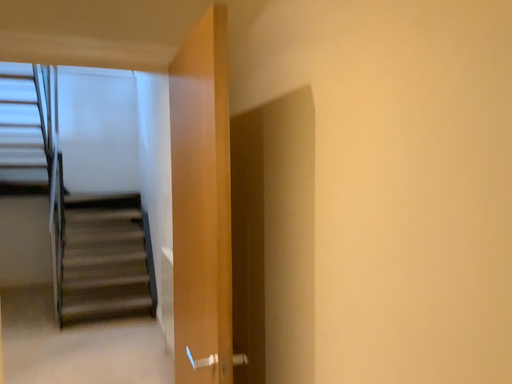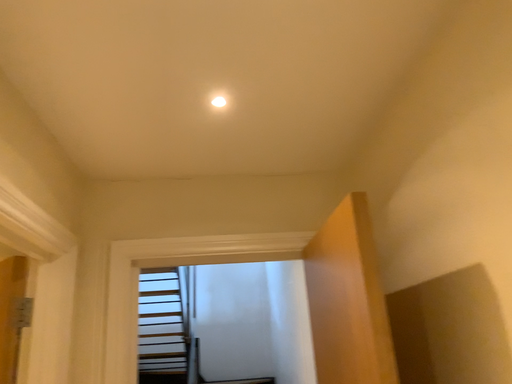
Question: Which way did the camera rotate in the video?

Choices:
 (A) rotated left
 (B) rotated right

Answer: (A)